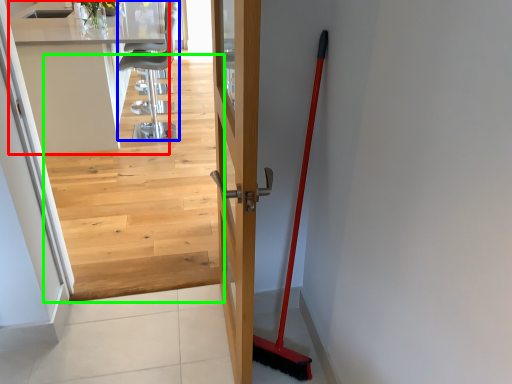
Question: Considering the real-world distances, which object is closest to counter top (highlighted by a red box)? chair (highlighted by a blue box) or stairwell (highlighted by a green box).

Choices:
 (A) chair
 (B) stairwell

Answer: (A)